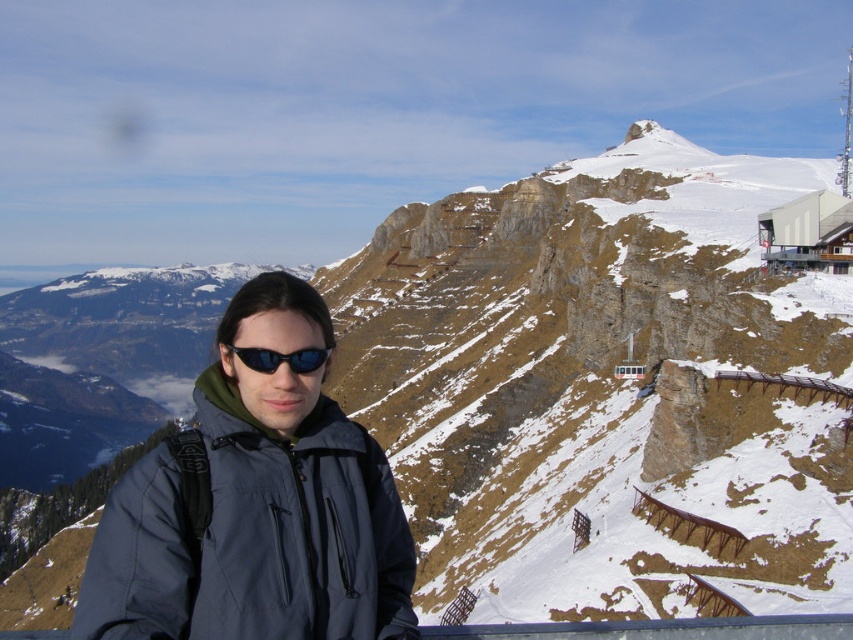
Question: Is dark gray/waterproof jacket at center to the right of black matte sunglasses at center from the viewer's perspective?

Choices:
 (A) no
 (B) yes

Answer: (B)

Question: Observing the image, what is the correct spatial positioning of dark gray/waterproof jacket at center in reference to black matte sunglasses at center?

Choices:
 (A) right
 (B) left

Answer: (A)

Question: From the image, what is the correct spatial relationship of dark gray/waterproof jacket at center in relation to black matte sunglasses at center?

Choices:
 (A) left
 (B) right

Answer: (B)

Question: Which of the following is the closest to the observer?

Choices:
 (A) dark gray/waterproof jacket at center
 (B) black matte sunglasses at center

Answer: (A)